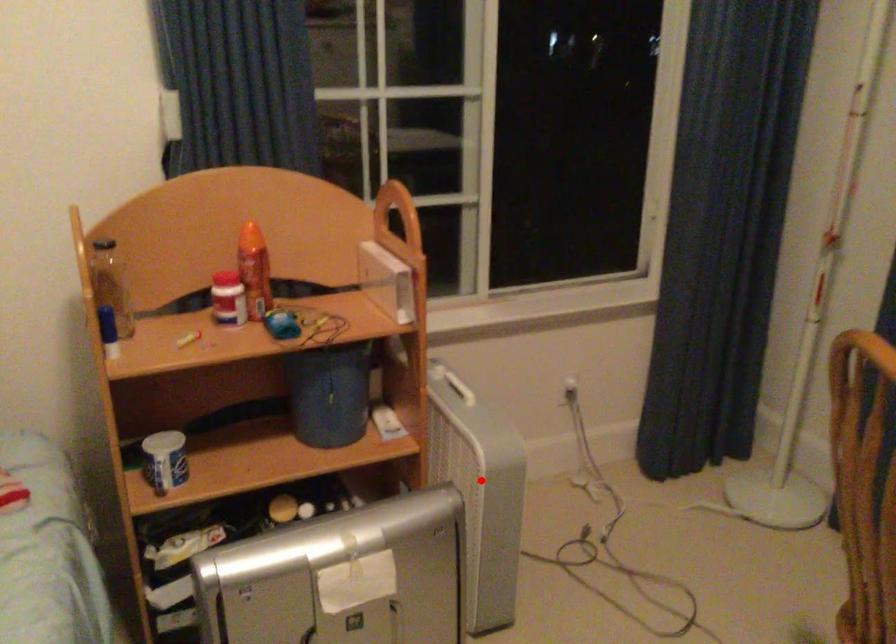
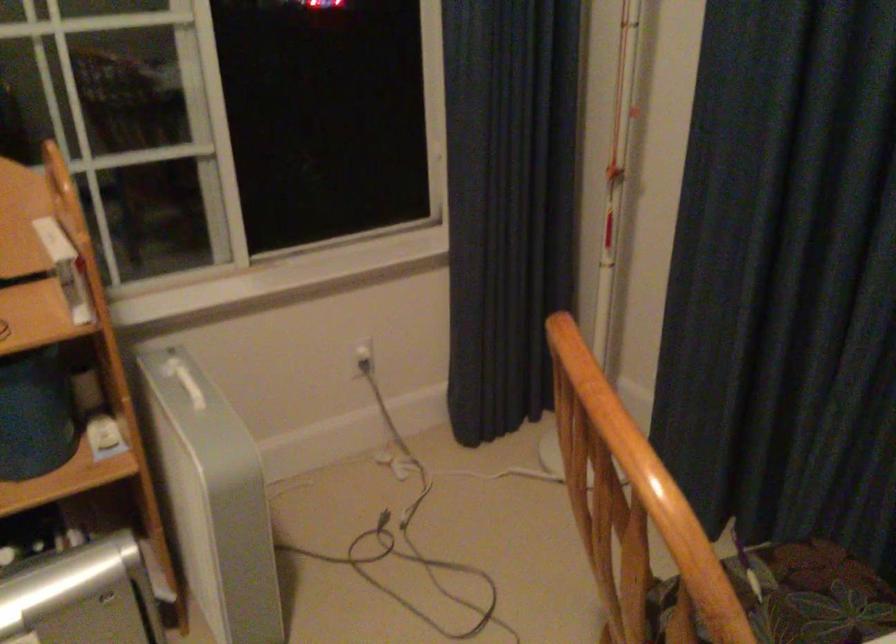
Locate, in the second image, the point that corresponds to the highlighted location in the first image.

(211, 498)